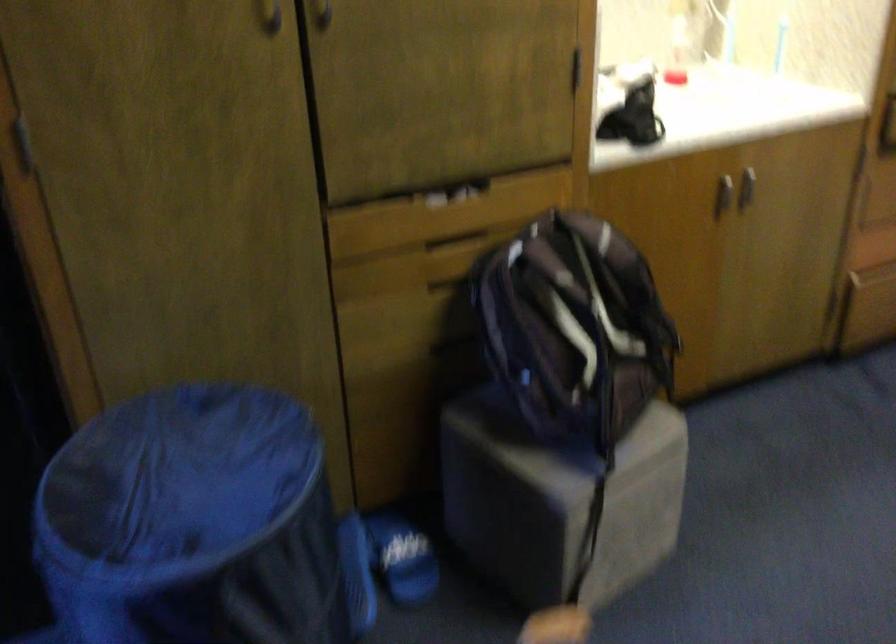
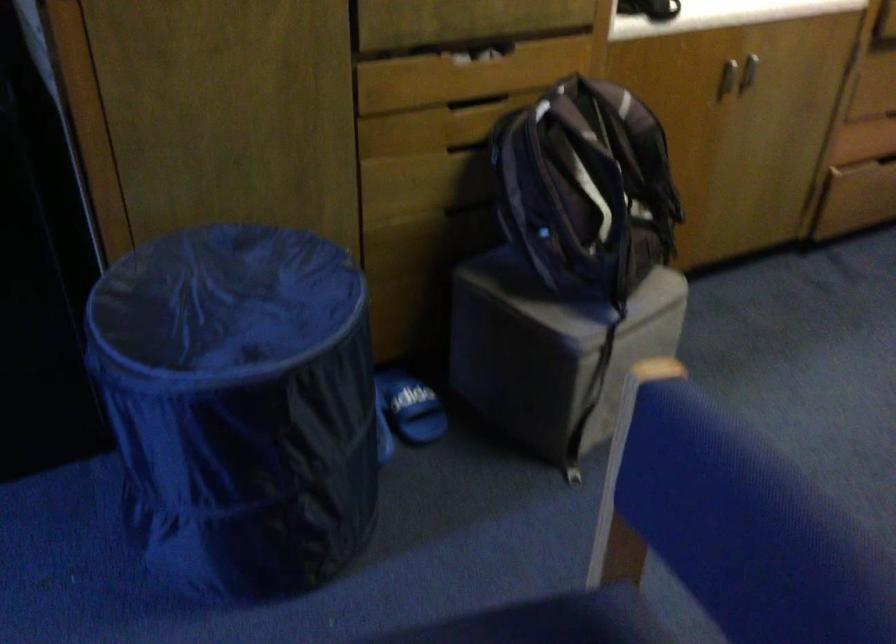
Where in the second image is the point corresponding to [458,342] from the first image?

(467, 205)